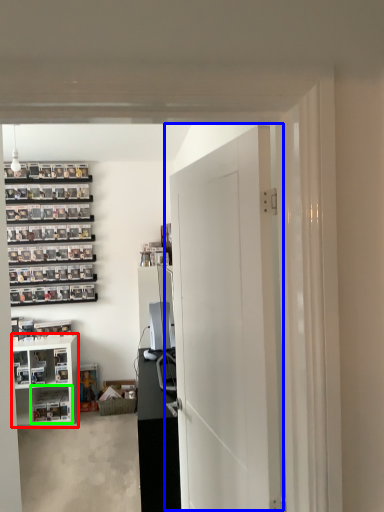
Question: Which object is the farthest from cabinetry (highlighted by a red box)? Choose among these: door (highlighted by a blue box) or shelf (highlighted by a green box).

Choices:
 (A) door
 (B) shelf

Answer: (A)